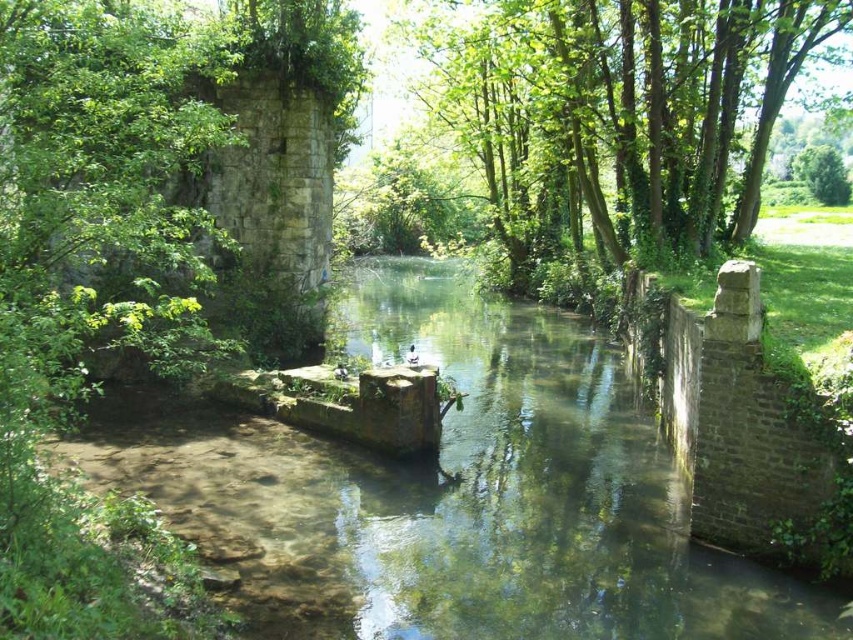
Question: Can you confirm if clear stone river at center is smaller than green leafy tree at upper center?

Choices:
 (A) no
 (B) yes

Answer: (B)

Question: Which of the following is the closest to the observer?

Choices:
 (A) (498, 595)
 (B) (607, 221)

Answer: (A)

Question: Where is clear stone river at center located in relation to green leafy tree at upper center in the image?

Choices:
 (A) right
 (B) left

Answer: (B)

Question: Considering the relative positions of clear stone river at center and green leafy tree at upper center in the image provided, where is clear stone river at center located with respect to green leafy tree at upper center?

Choices:
 (A) below
 (B) above

Answer: (A)